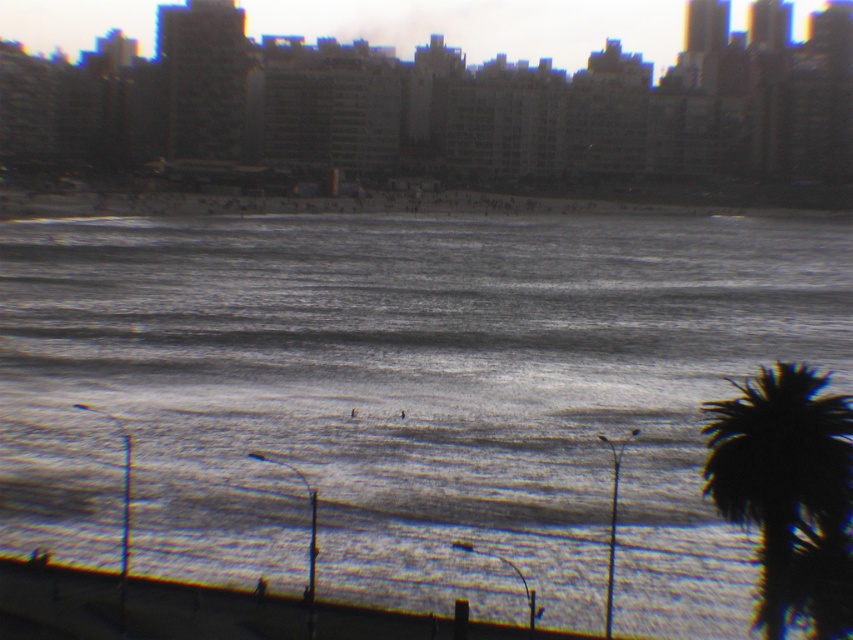
You are standing at the point marked as point (405,397) on the beach. What do you see directly in front of you?

At point (405,397) lies gray water at center.

You are standing on the beach and want to take a photo of the smooth concrete wall at lower center without the dark green leafy palm tree at lower right blocking it. How should you adjust your position?

Move to the left so that the dark green leafy palm tree at lower right is no longer in front of the smooth concrete wall at lower center. Since the palm tree is above the wall, shifting left would place the tree out of the frame or behind you, allowing an unobstructed view of the wall.

You are standing on the beach and want to take a photo of the dark green leafy palm tree at lower right and the smooth concrete wall at lower center. Which object will appear larger in the photo?

The dark green leafy palm tree at lower right is taller than the smooth concrete wall at lower center, so it will appear larger in the photo.